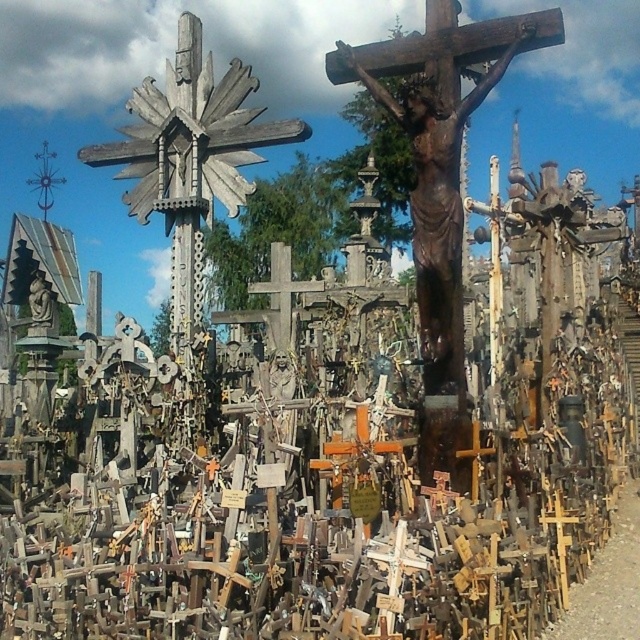
Is wooden crucifix at center to the left of wooden cross at upper left from the viewer's perspective?

In fact, wooden crucifix at center is to the right of wooden cross at upper left.

Is wooden crucifix at center shorter than wooden cross at upper left?

Yes, wooden crucifix at center is shorter than wooden cross at upper left.

Locate an element on the screen. This screenshot has height=640, width=640. wooden crucifix at center is located at coordinates (440, 188).